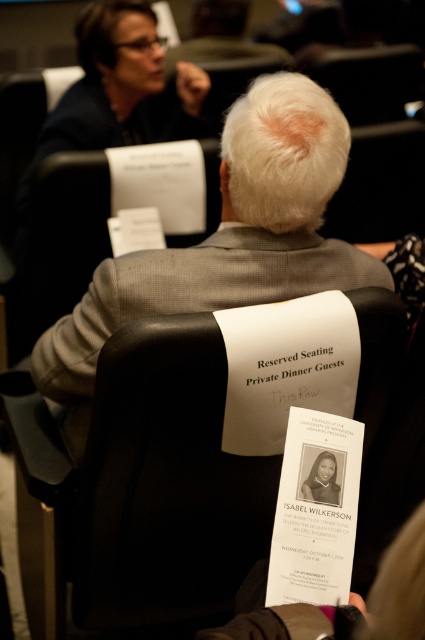
You are a photographer trying to capture a clear shot of both the gray woolen suit at center and the black paper brochure at center without any overlap. Based on the scene, which object should you position closer to the camera to ensure they don

The gray woolen suit at center might be wider than black paper brochure at center, so to avoid overlap, position the gray woolen suit at center closer to the camera since its width requires more space.

In the scene shown: You are organizing a small event and need to place a rectangular tablecloth that is 1.2 meters wide between the black leather chair at center and the gray woolen suit at center. Based on the size difference, will the tablecloth fit comfortably between them?

The black leather chair at center is larger in size than the gray woolen suit at center. The tablecloth is 1.2 meters wide, so it should fit comfortably between them since the space between the two objects can accommodate the tablecloth.